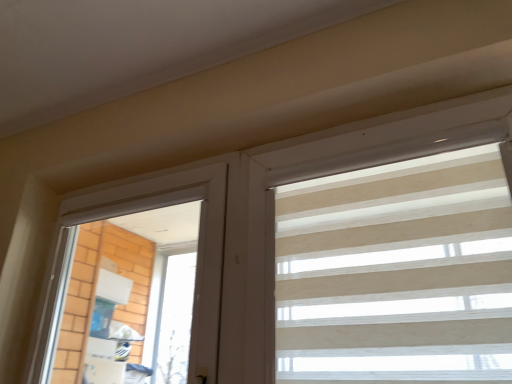
What do you see at coordinates (198, 246) in the screenshot? I see `white textured screen door at upper left` at bounding box center [198, 246].

From the picture: In order to face white textured screen door at upper left, should I rotate leftwards or rightwards?

It's best to rotate left around 18.196 degrees.

Where is `white textured screen door at upper left`? The height and width of the screenshot is (384, 512). white textured screen door at upper left is located at coordinates (198, 246).

Identify the location of white textured screen door at upper left. (198, 246).